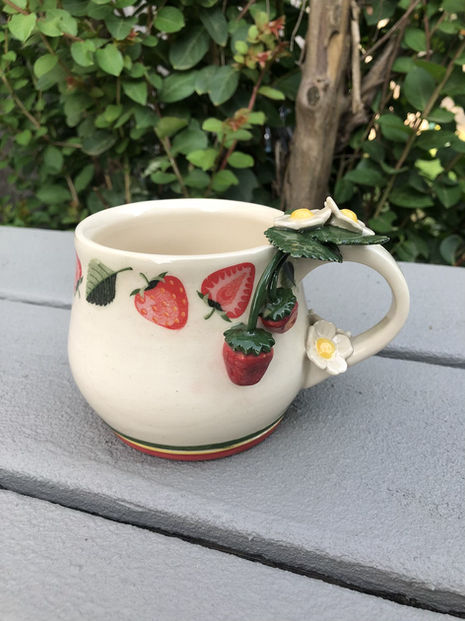
Locate an element on the screen. This screenshot has width=465, height=621. plant is located at coordinates (260, 296).